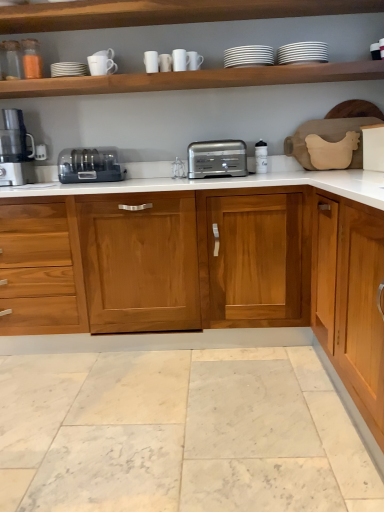
Question: Is white glossy plates at upper center, positioned as the 5th tableware in left-to-right order, to the right of white matte cup at upper center, positioned as the 5th tableware in right-to-left order, from the viewer's perspective?

Choices:
 (A) yes
 (B) no

Answer: (A)

Question: Is white glossy plates at upper center, which ranks as the 2th tableware in right-to-left order, positioned far away from white matte cup at upper center, positioned as the 5th tableware in right-to-left order?

Choices:
 (A) yes
 (B) no

Answer: (B)

Question: Considering the relative positions of white glossy plates at upper center, positioned as the 5th tableware in left-to-right order, and white matte cup at upper center, acting as the 2th tableware starting from the left, in the image provided, is white glossy plates at upper center, positioned as the 5th tableware in left-to-right order, to the left of white matte cup at upper center, acting as the 2th tableware starting from the left, from the viewer's perspective?

Choices:
 (A) yes
 (B) no

Answer: (B)

Question: From the image's perspective, is white glossy plates at upper center, which ranks as the 2th tableware in right-to-left order, over white matte cup at upper center, positioned as the 5th tableware in right-to-left order?

Choices:
 (A) yes
 (B) no

Answer: (A)

Question: Is white glossy plates at upper center, which ranks as the 2th tableware in right-to-left order, oriented towards white matte cup at upper center, positioned as the 5th tableware in right-to-left order?

Choices:
 (A) yes
 (B) no

Answer: (B)

Question: From the image's perspective, is white matte wood shelf at upper center, the 2th shelf from the top, located above or below wooden shelf at upper center, which is the first shelf from top to bottom?

Choices:
 (A) above
 (B) below

Answer: (B)

Question: Looking at their shapes, would you say white matte wood shelf at upper center, the 2th shelf from the top, is wider or thinner than wooden shelf at upper center, which appears as the 2th shelf when ordered from the bottom?

Choices:
 (A) thin
 (B) wide

Answer: (A)

Question: Is point 349,70 positioned closer to the camera than point 228,18?

Choices:
 (A) farther
 (B) closer

Answer: (B)

Question: Is white matte wood shelf at upper center, the first shelf from the bottom, in front of or behind wooden shelf at upper center, which is the first shelf from top to bottom, in the image?

Choices:
 (A) behind
 (B) front

Answer: (A)

Question: From the image's perspective, relative to wooden shelf at upper center, which is the first shelf from top to bottom, is white marble floor at lower center above or below?

Choices:
 (A) below
 (B) above

Answer: (A)

Question: Considering their positions, is white marble floor at lower center located in front of or behind wooden shelf at upper center, which appears as the 2th shelf when ordered from the bottom?

Choices:
 (A) front
 (B) behind

Answer: (A)

Question: Is white marble floor at lower center situated inside wooden shelf at upper center, which appears as the 2th shelf when ordered from the bottom, or outside?

Choices:
 (A) inside
 (B) outside

Answer: (B)

Question: Considering the positions of white marble floor at lower center and wooden shelf at upper center, which appears as the 2th shelf when ordered from the bottom, in the image, is white marble floor at lower center wider or thinner than wooden shelf at upper center, which appears as the 2th shelf when ordered from the bottom,?

Choices:
 (A) wide
 (B) thin

Answer: (A)

Question: Considering the positions of point (233, 167) and point (29, 175), is point (233, 167) closer or farther from the camera than point (29, 175)?

Choices:
 (A) closer
 (B) farther

Answer: (A)

Question: Is satin silver toaster at center, the first toaster from the right, bigger or smaller than matte black coffee machine at left?

Choices:
 (A) big
 (B) small

Answer: (B)